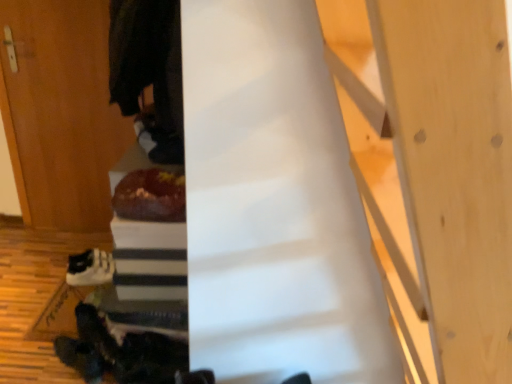
Question: From the image's perspective, is shiny chocolate cake at center located above dark woolen robe at upper left?

Choices:
 (A) no
 (B) yes

Answer: (A)

Question: Is the position of shiny chocolate cake at center less distant than that of dark woolen robe at upper left?

Choices:
 (A) no
 (B) yes

Answer: (A)

Question: Is dark woolen robe at upper left at the back of shiny chocolate cake at center?

Choices:
 (A) yes
 (B) no

Answer: (B)

Question: Does shiny chocolate cake at center have a lesser height compared to dark woolen robe at upper left?

Choices:
 (A) no
 (B) yes

Answer: (B)

Question: Is shiny chocolate cake at center at the right side of dark woolen robe at upper left?

Choices:
 (A) no
 (B) yes

Answer: (B)

Question: Considering the relative sizes of shiny chocolate cake at center and dark woolen robe at upper left in the image provided, is shiny chocolate cake at center wider than dark woolen robe at upper left?

Choices:
 (A) yes
 (B) no

Answer: (B)

Question: Is shiny chocolate cake at center a part of dark woolen robe at upper left?

Choices:
 (A) yes
 (B) no

Answer: (B)

Question: Is dark woolen robe at upper left turned away from shiny chocolate cake at center?

Choices:
 (A) no
 (B) yes

Answer: (A)

Question: From a real-world perspective, is dark woolen robe at upper left located higher than shiny chocolate cake at center?

Choices:
 (A) no
 (B) yes

Answer: (B)

Question: Is there a large distance between dark woolen robe at upper left and shiny chocolate cake at center?

Choices:
 (A) no
 (B) yes

Answer: (A)

Question: Considering the relative positions of dark woolen robe at upper left and shiny chocolate cake at center in the image provided, is dark woolen robe at upper left in front of shiny chocolate cake at center?

Choices:
 (A) yes
 (B) no

Answer: (A)

Question: Can you confirm if dark woolen robe at upper left is positioned to the left of shiny chocolate cake at center?

Choices:
 (A) yes
 (B) no

Answer: (A)

Question: Considering the relative positions of dark woolen robe at upper left and white matte sneakers at lower left in the image provided, is dark woolen robe at upper left behind white matte sneakers at lower left?

Choices:
 (A) no
 (B) yes

Answer: (A)